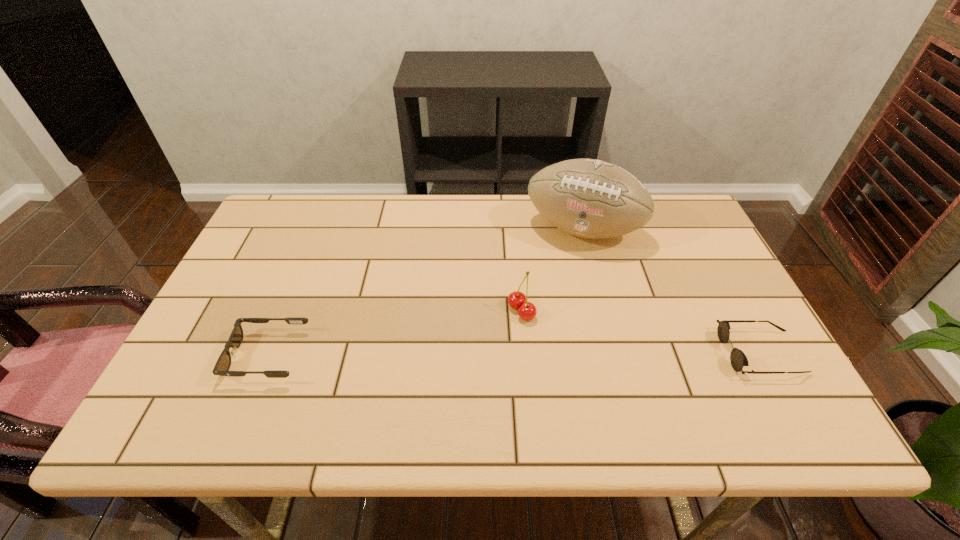
The image size is (960, 540). I want to click on the leftmost object, so click(x=222, y=366).

The image size is (960, 540). Identify the location of the rightmost object. (738, 359).

At what (x,y) coordinates should I click in order to perform the action: click on football (American). Please return your answer as a coordinate pair (x, y). Looking at the image, I should click on (588, 198).

Locate an element on the screen. the second object from right to left is located at coordinates (588, 198).

Find the location of a particular element. The height and width of the screenshot is (540, 960). the third object from right to left is located at coordinates (527, 311).

Where is `the second farthest object`? The width and height of the screenshot is (960, 540). the second farthest object is located at coordinates coord(527,311).

In order to click on vacant space situated on the temples of the leftmost object in this screenshot , I will do `click(209, 356)`.

The width and height of the screenshot is (960, 540). Identify the location of vacant point located 0.080m on the temples of the leftmost object. (197, 356).

Where is `vacant space located on the front-facing side of the rightmost object`? vacant space located on the front-facing side of the rightmost object is located at coordinates (573, 353).

Where is `free location located 0.120m on the front-facing side of the rightmost object`? The image size is (960, 540). free location located 0.120m on the front-facing side of the rightmost object is located at coordinates (672, 353).